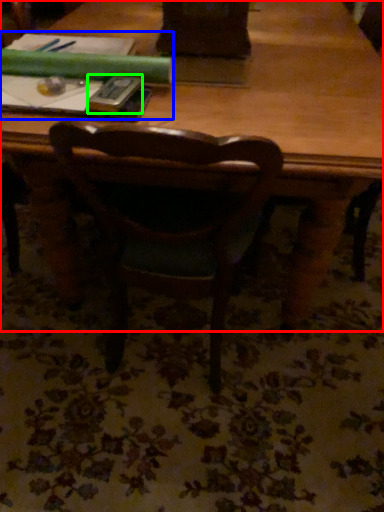
Question: Based on their relative distances, which object is farther from table (highlighted by a red box)? Choose from book (highlighted by a blue box) and paperback book (highlighted by a green box).

Choices:
 (A) book
 (B) paperback book

Answer: (B)